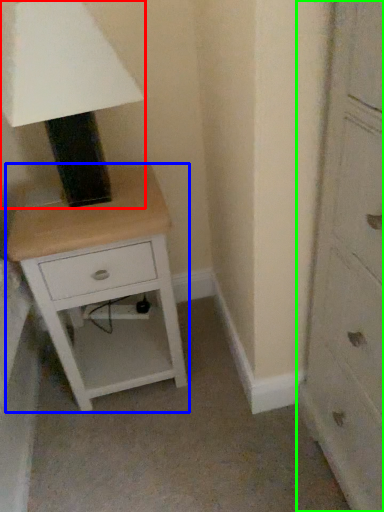
Question: Which object is positioned farthest from table lamp (highlighted by a red box)? Select from nightstand (highlighted by a blue box) and chest of drawers (highlighted by a green box).

Choices:
 (A) nightstand
 (B) chest of drawers

Answer: (B)